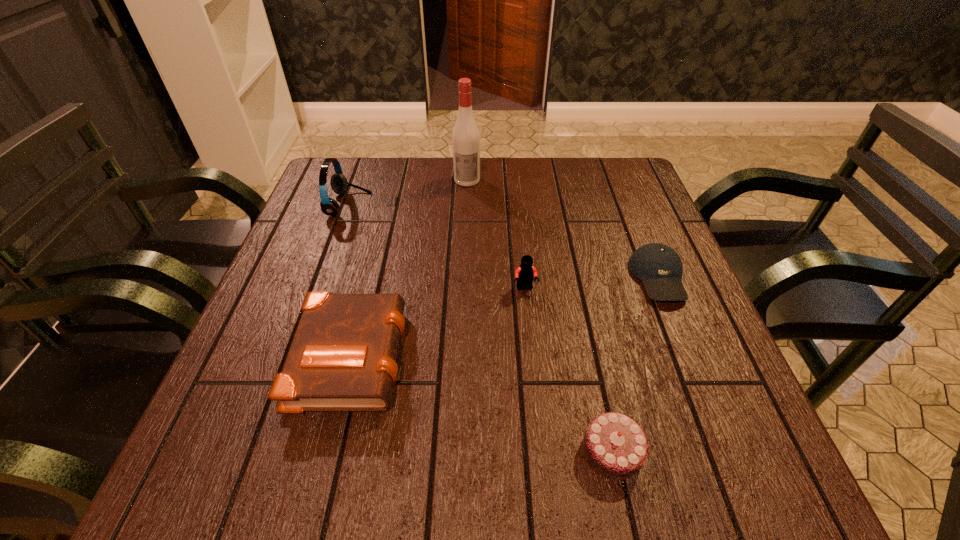
Locate which object ranks fourth in proximity to the rightmost object. Please provide its 2D coordinates. Your answer should be formatted as a tuple, i.e. [(x, y)], where the tuple contains the x and y coordinates of a point satisfying the conditions above.

[(343, 356)]

Find the location of `object that is the second closest to the second object from right to left`. object that is the second closest to the second object from right to left is located at coordinates (524, 274).

The height and width of the screenshot is (540, 960). Identify the location of free point that satisfies the following two spatial constraints: 1. on the front-facing side of the third tallest object; 2. on the spine side of the Bible. (532, 353).

Locate an element on the screen. This screenshot has width=960, height=540. free spot that satisfies the following two spatial constraints: 1. on the label of the third object from left to right; 2. on the spine side of the Bible is located at coordinates (461, 353).

Find the location of a particular element. Image resolution: width=960 pixels, height=540 pixels. free space in the image that satisfies the following two spatial constraints: 1. on the label of the chocolate cake; 2. on the left side of the alcohol is located at coordinates (457, 451).

Identify the location of blank area in the image that satisfies the following two spatial constraints: 1. with the microphone attached to the side of the headset; 2. on the right side of the chocolate cake. (261, 451).

Where is `free space that satisfies the following two spatial constraints: 1. on the label of the farthest object; 2. with the microphone attached to the side of the second farthest object`? free space that satisfies the following two spatial constraints: 1. on the label of the farthest object; 2. with the microphone attached to the side of the second farthest object is located at coordinates (467, 205).

In order to click on free space that satisfies the following two spatial constraints: 1. on the label of the fifth object from left to right; 2. on the right side of the third object from left to right in this screenshot , I will do `click(457, 451)`.

You are a GUI agent. You are given a task and a screenshot of the screen. Output one action in this format:
    pyautogui.click(x=<x>, y=<y>)
    Task: Click on the vacant space that satisfies the following two spatial constraints: 1. with the microphone attached to the side of the second object from right to left; 2. on the left side of the second tallest object
    The width and height of the screenshot is (960, 540).
    Given the screenshot: What is the action you would take?
    pyautogui.click(x=261, y=451)